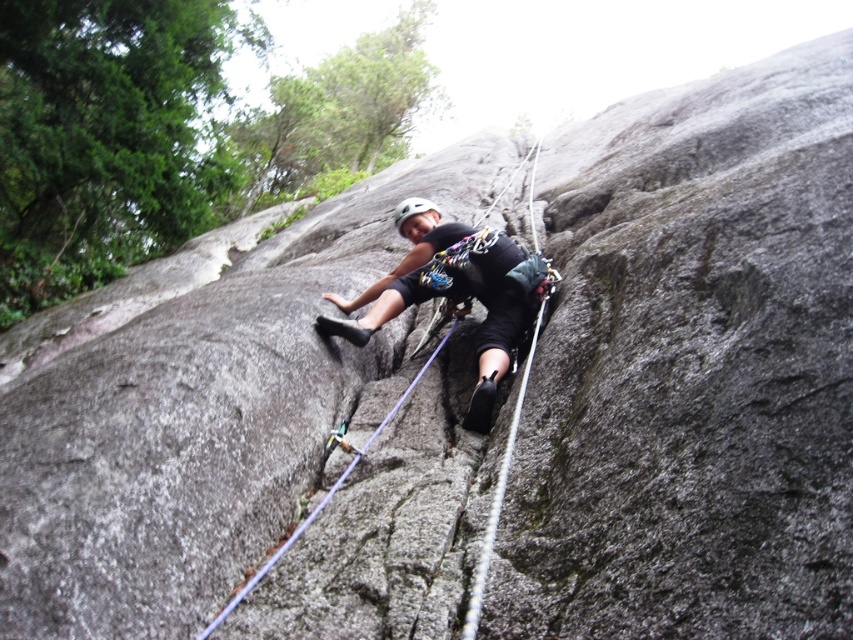
You are a safety inspector evaluating the rock climber. The climber is wearing a matte black helmet at center. According to safety protocols, the distance between the climber and their last anchor point must be less than 5 meters. Can the climber proceed safely?

The climber and their last anchor point are 4.27 meters apart, which is within the 5 meters safety requirement. Therefore, the climber can proceed safely.

You are a photographer taking a picture of a rock climber. You notice two helmets at the center of the image. Which helmet is taller, the matte black helmet at center or the white matte helmet at center?

The matte black helmet at center is taller than the white matte helmet at center according to the description.